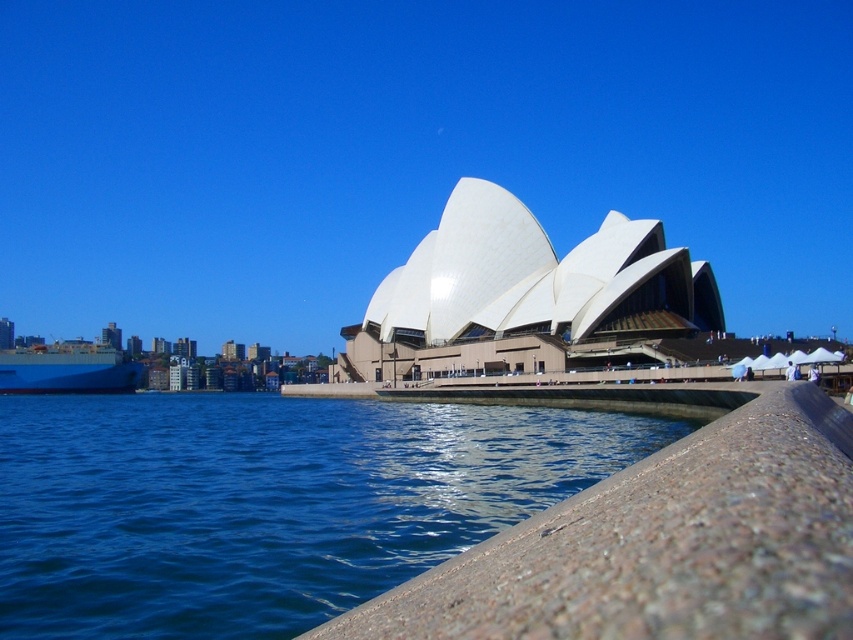
Does blue water at lower left have a greater height compared to blue matte ship at left?

Incorrect, blue water at lower left's height is not larger of blue matte ship at left's.

The image size is (853, 640). Describe the element at coordinates (265, 502) in the screenshot. I see `blue water at lower left` at that location.

Does point (367, 497) come closer to viewer compared to point (28, 360)?

Yes.

At what (x,y) coordinates should I click in order to perform the action: click on blue water at lower left. Please return your answer as a coordinate pair (x, y). Looking at the image, I should click on [265, 502].